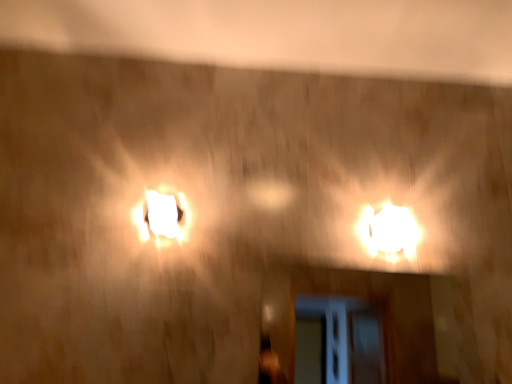
The height and width of the screenshot is (384, 512). What do you see at coordinates (162, 214) in the screenshot?
I see `white glossy lampshade at center, the 2th lamp positioned from the right` at bounding box center [162, 214].

The image size is (512, 384). Identify the location of white glossy lampshade at center, the 2th lamp positioned from the right. (162, 214).

What do you see at coordinates (389, 232) in the screenshot? I see `bright white plastic lamp at right, the 2th lamp positioned from the left` at bounding box center [389, 232].

Locate an element on the screen. The height and width of the screenshot is (384, 512). bright white plastic lamp at right, the 2th lamp positioned from the left is located at coordinates (389, 232).

How much space does bright white plastic lamp at right, which ranks as the 1th lamp in right-to-left order, occupy horizontally?

bright white plastic lamp at right, which ranks as the 1th lamp in right-to-left order, is 2.20 inches in width.

Measure the distance between point (385, 230) and camera.

4.03 feet.

The width and height of the screenshot is (512, 384). In order to click on white glossy lampshade at center, acting as the first lamp starting from the left in this screenshot , I will do `click(162, 214)`.

Considering the positions of objects bright white plastic lamp at right, which ranks as the 1th lamp in right-to-left order, and white glossy lampshade at center, acting as the first lamp starting from the left, in the image provided, who is more to the right, bright white plastic lamp at right, which ranks as the 1th lamp in right-to-left order, or white glossy lampshade at center, acting as the first lamp starting from the left,?

bright white plastic lamp at right, which ranks as the 1th lamp in right-to-left order, is more to the right.

In the scene shown: Considering the positions of objects bright white plastic lamp at right, the 2th lamp positioned from the left, and white glossy lampshade at center, acting as the first lamp starting from the left, in the image provided, who is behind, bright white plastic lamp at right, the 2th lamp positioned from the left, or white glossy lampshade at center, acting as the first lamp starting from the left,?

bright white plastic lamp at right, the 2th lamp positioned from the left, is behind.

Considering the positions of points (372, 246) and (177, 211), is point (372, 246) closer to camera compared to point (177, 211)?

No, (372, 246) is further to viewer.

From the image's perspective, between bright white plastic lamp at right, which ranks as the 1th lamp in right-to-left order, and white glossy lampshade at center, acting as the first lamp starting from the left, which one is located above?

white glossy lampshade at center, acting as the first lamp starting from the left.

From a real-world perspective, is bright white plastic lamp at right, which ranks as the 1th lamp in right-to-left order, physically below white glossy lampshade at center, the 2th lamp positioned from the right?

No, from a real-world perspective, bright white plastic lamp at right, which ranks as the 1th lamp in right-to-left order, is not under white glossy lampshade at center, the 2th lamp positioned from the right.

Between bright white plastic lamp at right, the 2th lamp positioned from the left, and white glossy lampshade at center, acting as the first lamp starting from the left, which one has smaller width?

white glossy lampshade at center, acting as the first lamp starting from the left, is thinner.

Is bright white plastic lamp at right, the 2th lamp positioned from the left, shorter than white glossy lampshade at center, the 2th lamp positioned from the right?

In fact, bright white plastic lamp at right, the 2th lamp positioned from the left, may be taller than white glossy lampshade at center, the 2th lamp positioned from the right.

Between bright white plastic lamp at right, the 2th lamp positioned from the left, and white glossy lampshade at center, acting as the first lamp starting from the left, which one has larger size?

bright white plastic lamp at right, the 2th lamp positioned from the left, is bigger.

Is bright white plastic lamp at right, the 2th lamp positioned from the left, located outside white glossy lampshade at center, the 2th lamp positioned from the right?

bright white plastic lamp at right, the 2th lamp positioned from the left, is positioned outside white glossy lampshade at center, the 2th lamp positioned from the right.

Is bright white plastic lamp at right, the 2th lamp positioned from the left, directly adjacent to white glossy lampshade at center, acting as the first lamp starting from the left?

bright white plastic lamp at right, the 2th lamp positioned from the left, and white glossy lampshade at center, acting as the first lamp starting from the left, are clearly separated.

Is bright white plastic lamp at right, which ranks as the 1th lamp in right-to-left order, facing towards white glossy lampshade at center, the 2th lamp positioned from the right?

No, bright white plastic lamp at right, which ranks as the 1th lamp in right-to-left order, is not aimed at white glossy lampshade at center, the 2th lamp positioned from the right.

You are a GUI agent. You are given a task and a screenshot of the screen. Output one action in this format:
    pyautogui.click(x=<x>, y=<y>)
    Task: Click on the lamp in front of the bright white plastic lamp at right, which ranks as the 1th lamp in right-to-left order
    
    Given the screenshot: What is the action you would take?
    pyautogui.click(x=162, y=214)

Between white glossy lampshade at center, acting as the first lamp starting from the left, and bright white plastic lamp at right, the 2th lamp positioned from the left, which one appears on the right side from the viewer's perspective?

Positioned to the right is bright white plastic lamp at right, the 2th lamp positioned from the left.

Between white glossy lampshade at center, the 2th lamp positioned from the right, and bright white plastic lamp at right, which ranks as the 1th lamp in right-to-left order, which one is positioned in front?

white glossy lampshade at center, the 2th lamp positioned from the right, is closer to the camera.

Considering the points (170, 200) and (361, 237), which point is in front, point (170, 200) or point (361, 237)?

The point (170, 200) is in front.

From the image's perspective, is white glossy lampshade at center, the 2th lamp positioned from the right, positioned above or below bright white plastic lamp at right, the 2th lamp positioned from the left?

white glossy lampshade at center, the 2th lamp positioned from the right, is situated higher than bright white plastic lamp at right, the 2th lamp positioned from the left, in the image.

From a real-world perspective, does white glossy lampshade at center, the 2th lamp positioned from the right, stand above bright white plastic lamp at right, the 2th lamp positioned from the left?

No, from a real-world perspective, white glossy lampshade at center, the 2th lamp positioned from the right, is not above bright white plastic lamp at right, the 2th lamp positioned from the left.

Is white glossy lampshade at center, acting as the first lamp starting from the left, wider or thinner than bright white plastic lamp at right, the 2th lamp positioned from the left?

Clearly, white glossy lampshade at center, acting as the first lamp starting from the left, has less width compared to bright white plastic lamp at right, the 2th lamp positioned from the left.

Considering the sizes of objects white glossy lampshade at center, the 2th lamp positioned from the right, and bright white plastic lamp at right, the 2th lamp positioned from the left, in the image provided, who is shorter, white glossy lampshade at center, the 2th lamp positioned from the right, or bright white plastic lamp at right, the 2th lamp positioned from the left,?

With less height is white glossy lampshade at center, the 2th lamp positioned from the right.

Between white glossy lampshade at center, acting as the first lamp starting from the left, and bright white plastic lamp at right, the 2th lamp positioned from the left, which one has larger size?

bright white plastic lamp at right, the 2th lamp positioned from the left.

Is white glossy lampshade at center, acting as the first lamp starting from the left, inside the boundaries of bright white plastic lamp at right, the 2th lamp positioned from the left, or outside?

white glossy lampshade at center, acting as the first lamp starting from the left, is spatially situated outside bright white plastic lamp at right, the 2th lamp positioned from the left.

Are white glossy lampshade at center, the 2th lamp positioned from the right, and bright white plastic lamp at right, which ranks as the 1th lamp in right-to-left order, located far from each other?

Actually, white glossy lampshade at center, the 2th lamp positioned from the right, and bright white plastic lamp at right, which ranks as the 1th lamp in right-to-left order, are a little close together.

Is white glossy lampshade at center, the 2th lamp positioned from the right, aimed at bright white plastic lamp at right, the 2th lamp positioned from the left?

No, white glossy lampshade at center, the 2th lamp positioned from the right, is not turned towards bright white plastic lamp at right, the 2th lamp positioned from the left.

What's the angular difference between white glossy lampshade at center, the 2th lamp positioned from the right, and bright white plastic lamp at right, the 2th lamp positioned from the left,'s facing directions?

white glossy lampshade at center, the 2th lamp positioned from the right, and bright white plastic lamp at right, the 2th lamp positioned from the left, are facing 0.155 degrees away from each other.

Where is `lamp behind the white glossy lampshade at center, acting as the first lamp starting from the left`? lamp behind the white glossy lampshade at center, acting as the first lamp starting from the left is located at coordinates (389, 232).

Identify the location of lamp located on the left of bright white plastic lamp at right, the 2th lamp positioned from the left. pos(162,214).

The width and height of the screenshot is (512, 384). Identify the location of lamp behind the white glossy lampshade at center, acting as the first lamp starting from the left. (389, 232).